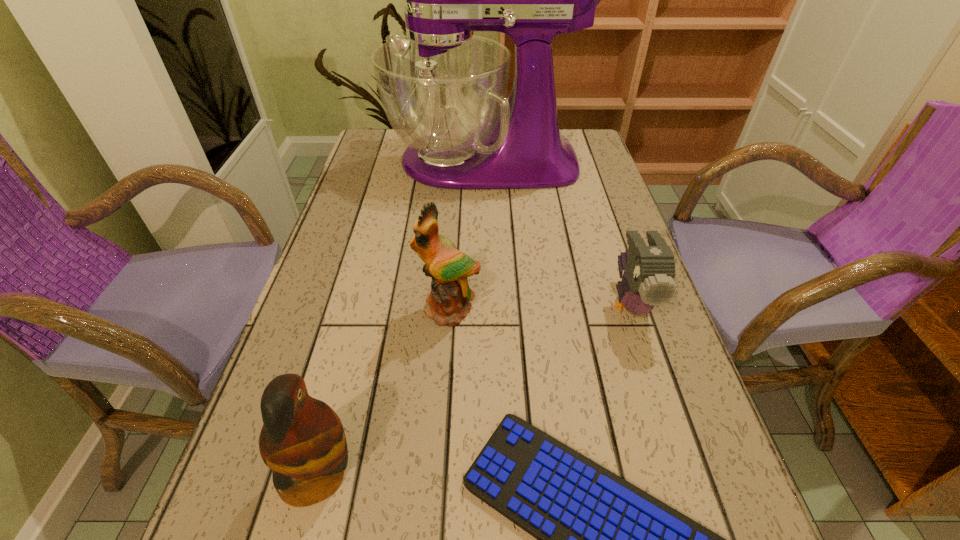
Find the location of `the tallest object`. the tallest object is located at coordinates (443, 89).

Identify the location of mixer. (443, 89).

Where is `the farther parrot`? The width and height of the screenshot is (960, 540). the farther parrot is located at coordinates pyautogui.click(x=447, y=303).

What are the coordinates of `the left parrot` in the screenshot? It's located at (302, 440).

Where is `the second shortest object`? This screenshot has height=540, width=960. the second shortest object is located at coordinates (649, 271).

This screenshot has height=540, width=960. Find the location of `vacant space positioned 0.080m at the bowl opening of the mixer`. vacant space positioned 0.080m at the bowl opening of the mixer is located at coordinates (362, 161).

In order to click on vacant space located 0.070m at the bowl opening of the mixer in this screenshot , I will do `click(365, 161)`.

This screenshot has height=540, width=960. I want to click on free point located at the bowl opening of the mixer, so click(365, 161).

Where is `free space located on the front-facing side of the right parrot`? Image resolution: width=960 pixels, height=540 pixels. free space located on the front-facing side of the right parrot is located at coordinates (437, 481).

Find the location of a particular element. This screenshot has width=960, height=540. blank area located on the face of the left parrot is located at coordinates (429, 475).